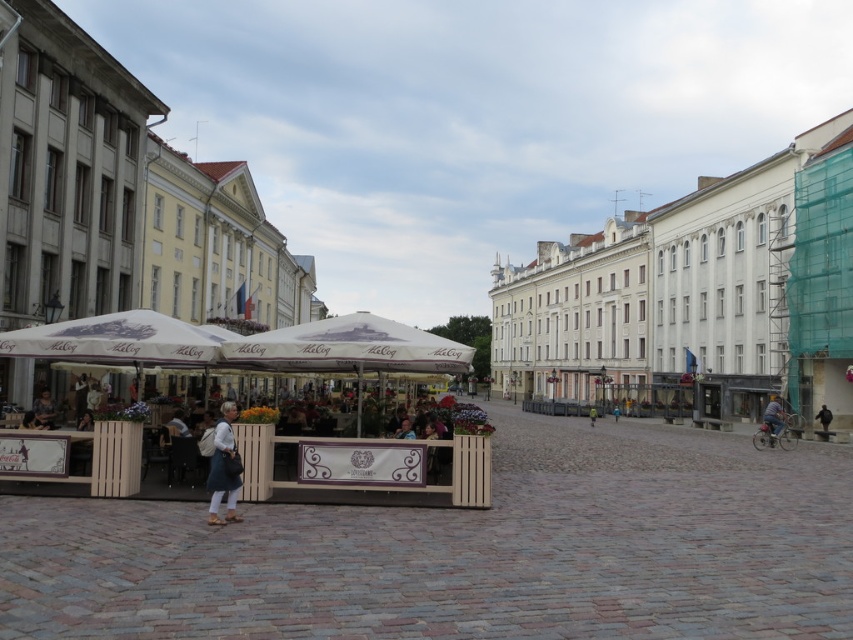
You are a pedestrian standing at the edge of the square and want to find shade. You see the white fabric canopy at center and the matte black jacket at lower left. Which object can provide shade?

The white fabric canopy at center is above matte black jacket at lower left, so the white fabric canopy at center can provide shade.

You are a photographer standing in the urban square and want to capture both the blue denim jeans at lower right and the green fabric jacket at center in the same frame. Which object should you position closer to the left side of your camera viewfinder to include both?

To include both the blue denim jeans at lower right and the green fabric jacket at center in the same frame, you should position the green fabric jacket at center closer to the left side of your camera viewfinder since the blue denim jeans at lower right is already on the right side of the green fabric jacket at center.

You are a delivery person with a cart that can only travel 60 meters. You need to deliver a package from the white wood market at center to the black leather jacket at center. Can you make the delivery without needing to recharge your cart?

The distance between the white wood market at center and the black leather jacket at center is 60.17 meters, which exceeds the cart maximum travel distance of 60 meters. Therefore, you cannot make the delivery without recharging your cart.